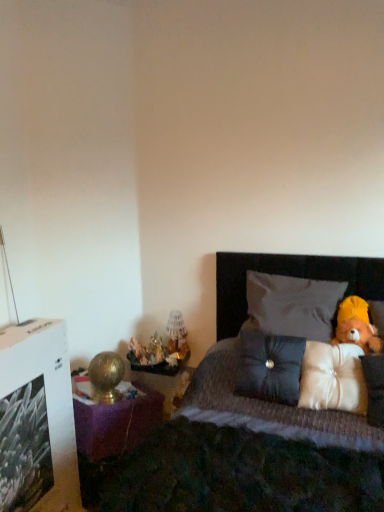
Question: Is dark fabric bed at right at the left side of white fabric pillow at upper right, which is the 3th pillow in bottom-to-top order?

Choices:
 (A) yes
 (B) no

Answer: (A)

Question: Can you confirm if dark fabric bed at right is thinner than white fabric pillow at upper right, the 1th pillow viewed from the top?

Choices:
 (A) yes
 (B) no

Answer: (B)

Question: Is dark fabric bed at right positioned with its back to white fabric pillow at upper right, which is the 3th pillow in bottom-to-top order?

Choices:
 (A) yes
 (B) no

Answer: (A)

Question: Does dark fabric bed at right turn towards white fabric pillow at upper right, the 1th pillow viewed from the top?

Choices:
 (A) yes
 (B) no

Answer: (B)

Question: Does dark fabric bed at right have a greater width compared to white fabric pillow at upper right, the 1th pillow viewed from the top?

Choices:
 (A) no
 (B) yes

Answer: (B)

Question: Considering the positions of metallic gold figurines at left and satin dark gray pillow at center, the 2th pillow from the bottom, in the image, is metallic gold figurines at left wider or thinner than satin dark gray pillow at center, the 2th pillow from the bottom,?

Choices:
 (A) thin
 (B) wide

Answer: (B)

Question: From a real-world perspective, is metallic gold figurines at left physically located above or below satin dark gray pillow at center, the second pillow when ordered from top to bottom?

Choices:
 (A) above
 (B) below

Answer: (B)

Question: From the image's perspective, is metallic gold figurines at left located above or below satin dark gray pillow at center, the second pillow when ordered from top to bottom?

Choices:
 (A) below
 (B) above

Answer: (A)

Question: From their relative heights in the image, would you say metallic gold figurines at left is taller or shorter than satin dark gray pillow at center, the 2th pillow from the bottom?

Choices:
 (A) short
 (B) tall

Answer: (A)

Question: In terms of width, does yellow plush teddy bear at right look wider or thinner when compared to satin dark gray pillow at center, the second pillow when ordered from top to bottom?

Choices:
 (A) wide
 (B) thin

Answer: (B)

Question: In the image, is yellow plush teddy bear at right positioned in front of or behind satin dark gray pillow at center, the 2th pillow from the bottom?

Choices:
 (A) behind
 (B) front

Answer: (A)

Question: From the image's perspective, relative to satin dark gray pillow at center, the 2th pillow from the bottom, is yellow plush teddy bear at right above or below?

Choices:
 (A) above
 (B) below

Answer: (A)

Question: Does point (362, 304) appear closer or farther from the camera than point (289, 342)?

Choices:
 (A) farther
 (B) closer

Answer: (A)

Question: Is point (261, 325) closer or farther from the camera than point (140, 349)?

Choices:
 (A) closer
 (B) farther

Answer: (A)

Question: From the image's perspective, relative to matte gold figurine at left, is white fabric pillow at upper right, the 1th pillow viewed from the top, above or below?

Choices:
 (A) above
 (B) below

Answer: (A)